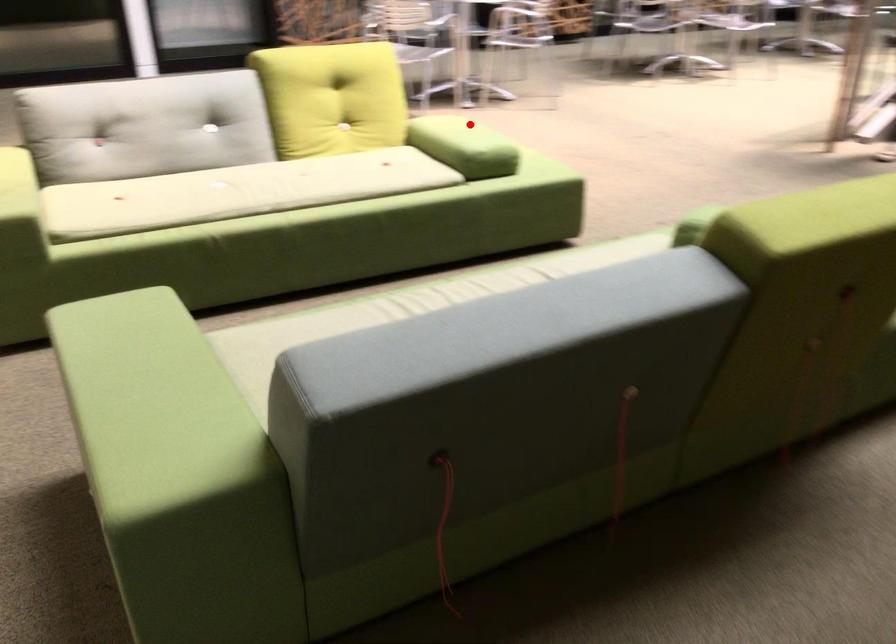
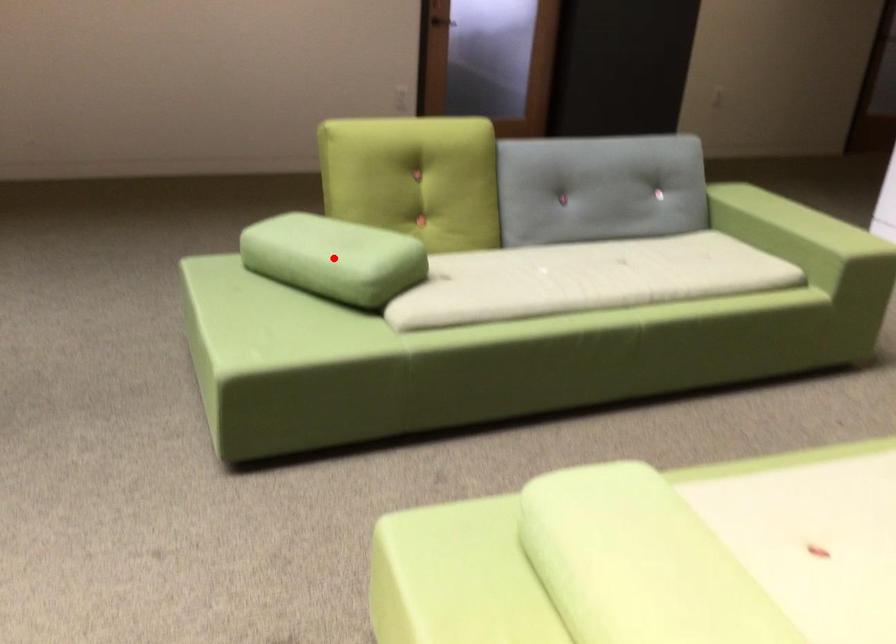
I am providing you with two images of the same scene from different viewpoints. A red point is marked on the first image and another point is marked on the second image. Does the point marked in image1 correspond to the same location as the one in image2?

No